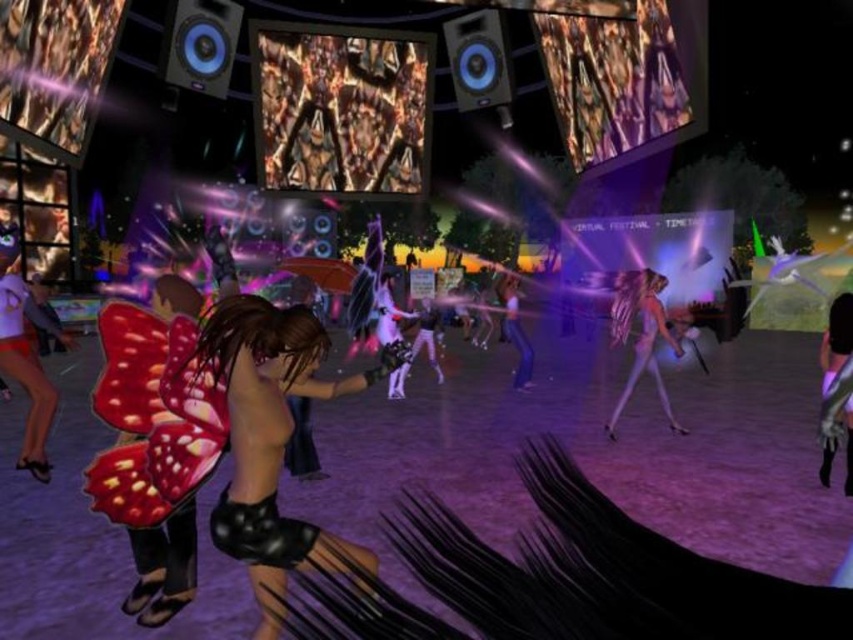
Question: Which point is farther from the camera taking this photo?

Choices:
 (A) (619, 298)
 (B) (274, 406)

Answer: (A)

Question: Can you confirm if shiny black shorts at center is positioned below translucent purple hair at center?

Choices:
 (A) yes
 (B) no

Answer: (A)

Question: Where is shiny black shorts at center located in relation to translucent purple hair at center in the image?

Choices:
 (A) above
 (B) below

Answer: (B)

Question: Is shiny black shorts at center above translucent purple hair at center?

Choices:
 (A) yes
 (B) no

Answer: (B)

Question: Which object appears farthest from the camera in this image?

Choices:
 (A) shiny black shorts at center
 (B) translucent purple hair at center

Answer: (B)